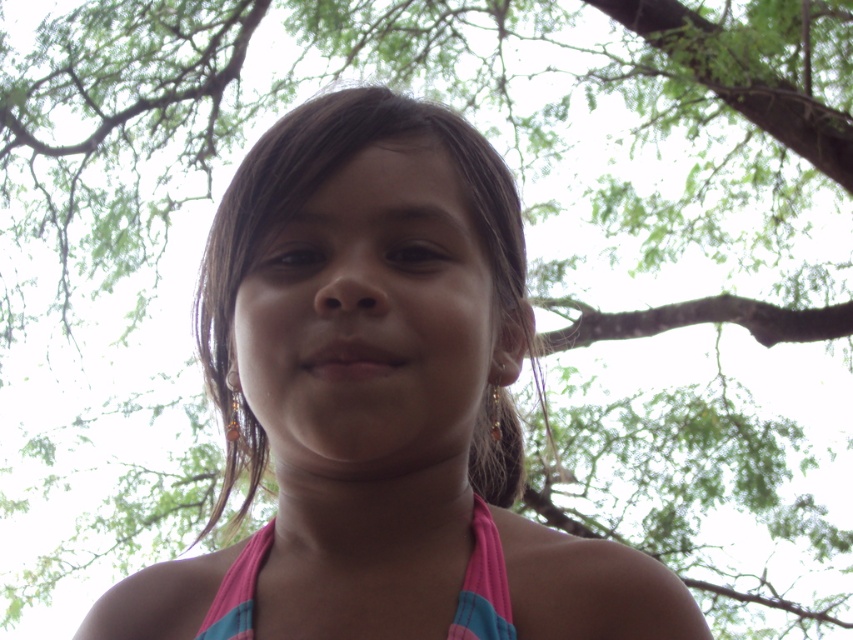
You are standing at the point with coordinates point (485, 604) and want to walk towards the girl in the scene. There is an obstacle at point (267, 387). Will you be able to see the girl clearly while moving towards her?

Point (267, 387) is in front of point (485, 604), so the obstacle at point (267, 387) will block your view of the girl while moving towards her.

The girl is wearing a pink fabric bikini top at center and has a pink fabric at center. Which one is closer to you?

The pink fabric at center is closer to the viewer than the pink fabric bikini top at center.